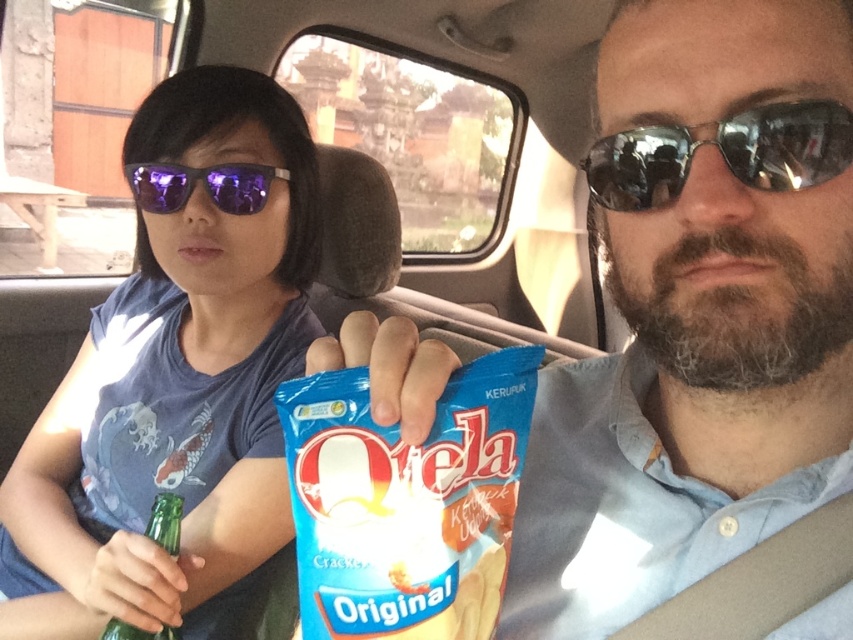
Which of these two, blue matte qela crackers at center or silver reflective sunglasses at upper right, stands taller?

blue matte qela crackers at center

Is blue matte qela crackers at center positioned before silver reflective sunglasses at upper right?

Yes, it is in front of silver reflective sunglasses at upper right.

Who is more forward, (355, 435) or (721, 145)?

Point (355, 435) is in front.

The width and height of the screenshot is (853, 640). Find the location of `blue matte qela crackers at center`. blue matte qela crackers at center is located at coordinates (405, 500).

Which of these two, blue matte qela crackers at center or purple reflective sunglasses at center, stands taller?

Standing taller between the two is blue matte qela crackers at center.

Does blue matte qela crackers at center have a lesser width compared to purple reflective sunglasses at center?

Yes, blue matte qela crackers at center is thinner than purple reflective sunglasses at center.

Is point (485, 388) closer to viewer compared to point (170, 168)?

Yes, point (485, 388) is in front of point (170, 168).

The height and width of the screenshot is (640, 853). I want to click on blue matte qela crackers at center, so click(405, 500).

Is blue fabric shirt at left further to camera compared to green glass bottle at lower left?

No, it is in front of green glass bottle at lower left.

Does blue fabric shirt at left have a lesser height compared to green glass bottle at lower left?

Incorrect, blue fabric shirt at left's height does not fall short of green glass bottle at lower left's.

Does point (187, 88) lie behind point (167, 547)?

Yes, it is behind point (167, 547).

Where is `blue fabric shirt at left`? The height and width of the screenshot is (640, 853). blue fabric shirt at left is located at coordinates (175, 381).